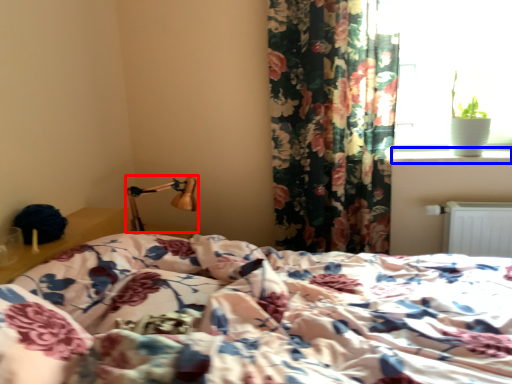
Question: Which point is closer to the camera, bedside lamp (highlighted by a red box) or window sill (highlighted by a blue box)?

Choices:
 (A) bedside lamp
 (B) window sill

Answer: (A)